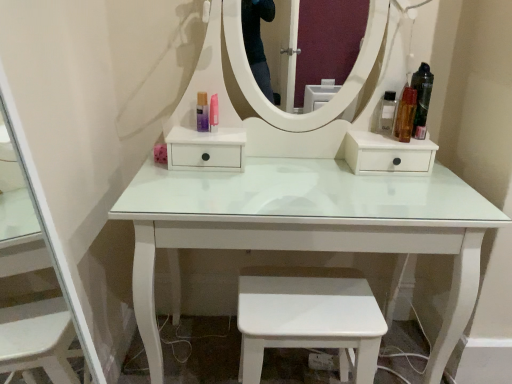
Question: From the image's perspective, would you say pink glossy lipstick at center, which is counted as the 2th toiletry, starting from the left, is positioned over white glossy step stool at lower center?

Choices:
 (A) no
 (B) yes

Answer: (B)

Question: Considering the relative positions of pink glossy lipstick at center, which is counted as the 2th toiletry, starting from the left, and white glossy step stool at lower center in the image provided, is pink glossy lipstick at center, which is counted as the 2th toiletry, starting from the left, behind white glossy step stool at lower center?

Choices:
 (A) no
 (B) yes

Answer: (B)

Question: Is pink glossy lipstick at center, which is counted as the 2th toiletry, starting from the left, touching white glossy step stool at lower center?

Choices:
 (A) yes
 (B) no

Answer: (B)

Question: Can white glossy step stool at lower center be found inside pink glossy lipstick at center, which is the fourth toiletry in right-to-left order?

Choices:
 (A) no
 (B) yes

Answer: (A)

Question: Does pink glossy lipstick at center, which is counted as the 2th toiletry, starting from the left, have a larger size compared to white glossy step stool at lower center?

Choices:
 (A) yes
 (B) no

Answer: (B)

Question: Is satin silver spray can at right, which appears as the third toiletry when viewed from the left, in front of or behind shiny black hair spray at upper right, which is the 5th toiletry in left-to-right order, in the image?

Choices:
 (A) front
 (B) behind

Answer: (B)

Question: Considering the positions of point (381, 104) and point (429, 92), is point (381, 104) closer or farther from the camera than point (429, 92)?

Choices:
 (A) farther
 (B) closer

Answer: (A)

Question: From the image's perspective, relative to shiny black hair spray at upper right, which ranks as the 1th toiletry in right-to-left order, is satin silver spray can at right, which appears as the third toiletry when viewed from the left, above or below?

Choices:
 (A) below
 (B) above

Answer: (A)

Question: Is satin silver spray can at right, the 3th toiletry when ordered from right to left, taller or shorter than shiny black hair spray at upper right, which is the 5th toiletry in left-to-right order?

Choices:
 (A) tall
 (B) short

Answer: (B)

Question: Is translucent amber bottle at right, the 2th toiletry viewed from the right, inside the boundaries of pink glossy lipstick at center, which is the fourth toiletry in right-to-left order, or outside?

Choices:
 (A) outside
 (B) inside

Answer: (A)

Question: Considering the relative positions of translucent amber bottle at right, the 2th toiletry viewed from the right, and pink glossy lipstick at center, which is the fourth toiletry in right-to-left order, in the image provided, is translucent amber bottle at right, the 2th toiletry viewed from the right, to the left or to the right of pink glossy lipstick at center, which is the fourth toiletry in right-to-left order,?

Choices:
 (A) right
 (B) left

Answer: (A)

Question: Is point (398, 109) positioned closer to the camera than point (212, 94)?

Choices:
 (A) closer
 (B) farther

Answer: (A)

Question: From the image's perspective, is translucent amber bottle at right, the 2th toiletry viewed from the right, located above or below pink glossy lipstick at center, which is counted as the 2th toiletry, starting from the left?

Choices:
 (A) below
 (B) above

Answer: (A)

Question: Is point (241, 352) closer or farther from the camera than point (404, 99)?

Choices:
 (A) farther
 (B) closer

Answer: (A)

Question: From a real-world perspective, is white glossy step stool at lower center above or below translucent amber bottle at right, the 2th toiletry viewed from the right?

Choices:
 (A) below
 (B) above

Answer: (A)